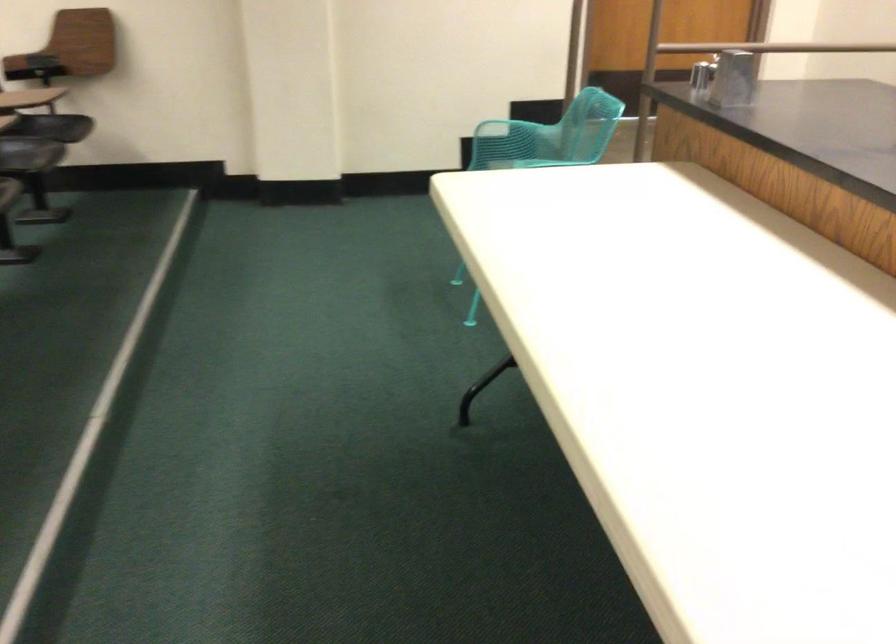
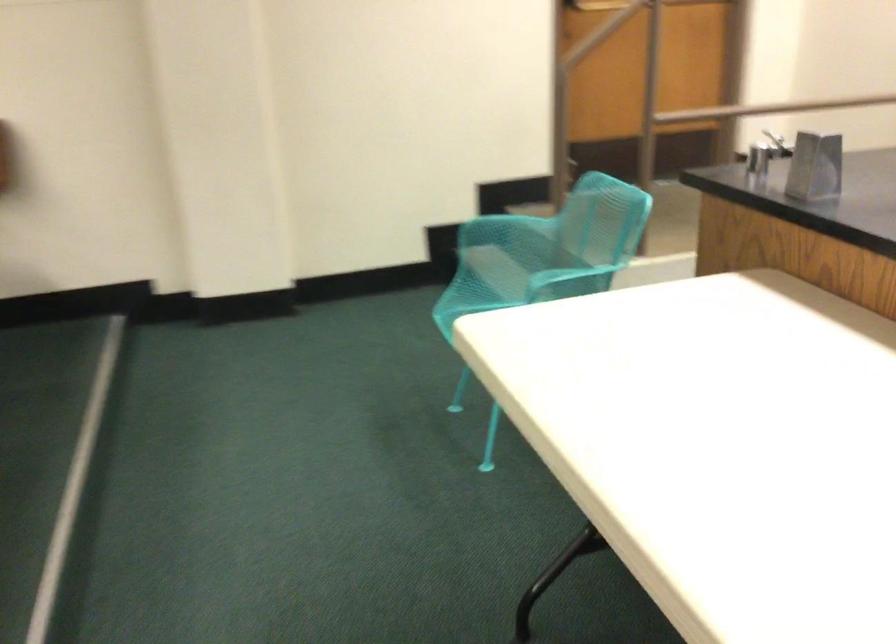
Question: The camera is either moving clockwise (left) or counter-clockwise (right) around the object. The first image is from the beginning of the video and the second image is from the end. Is the camera moving left or right when shooting the video?

Choices:
 (A) Left
 (B) Right

Answer: (A)